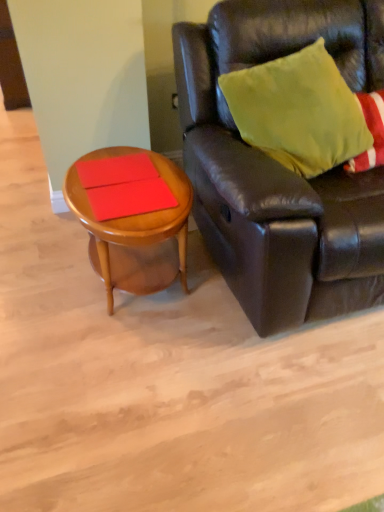
You are a GUI agent. You are given a task and a screenshot of the screen. Output one action in this format:
    pyautogui.click(x=<x>, y=<y>)
    Task: Click on the free space above matte red book at center, positioned as the 1th plank in bottom-to-top order (from a real-world perspective)
    The height and width of the screenshot is (512, 384).
    Given the screenshot: What is the action you would take?
    pyautogui.click(x=129, y=195)